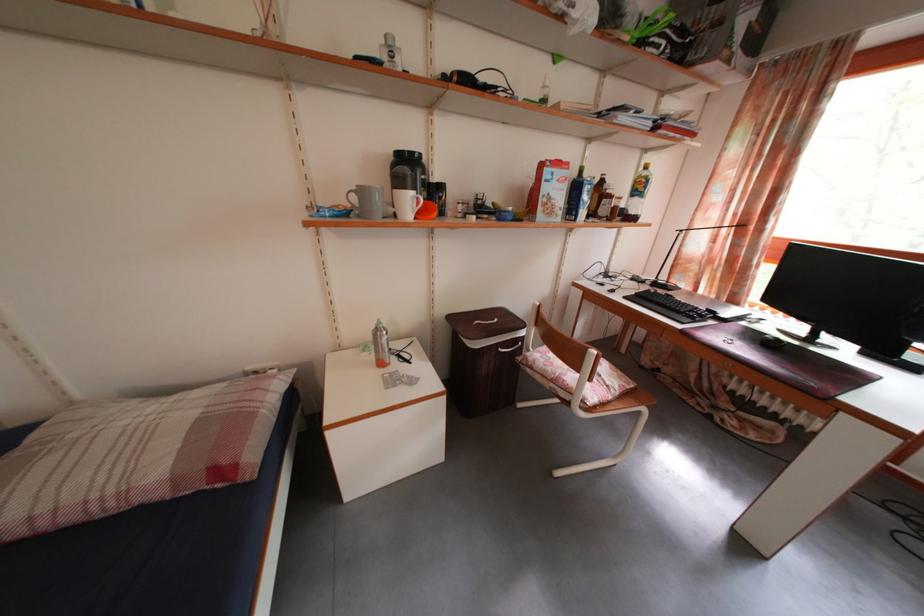
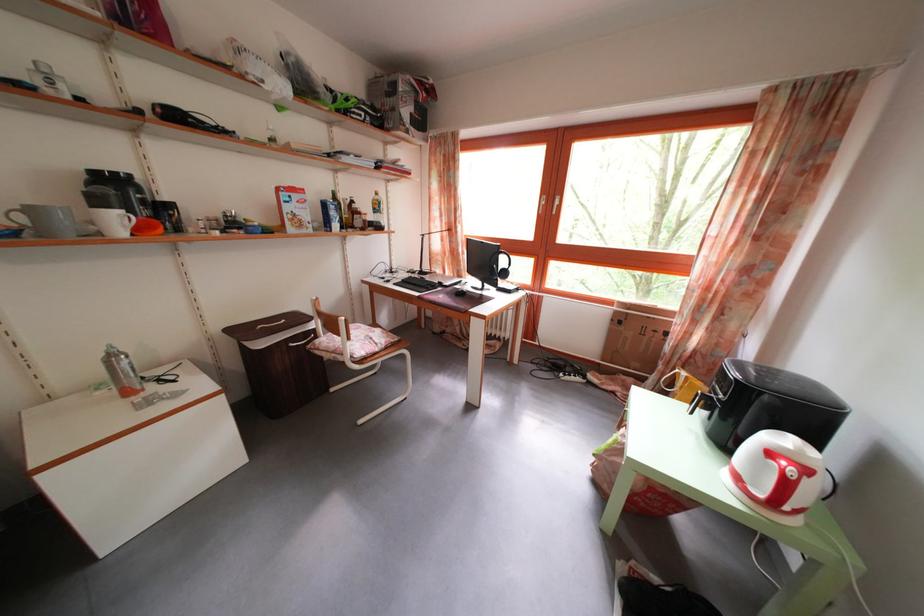
In the second image, find the point that corresponds to point 384,338 in the first image.

(118, 363)